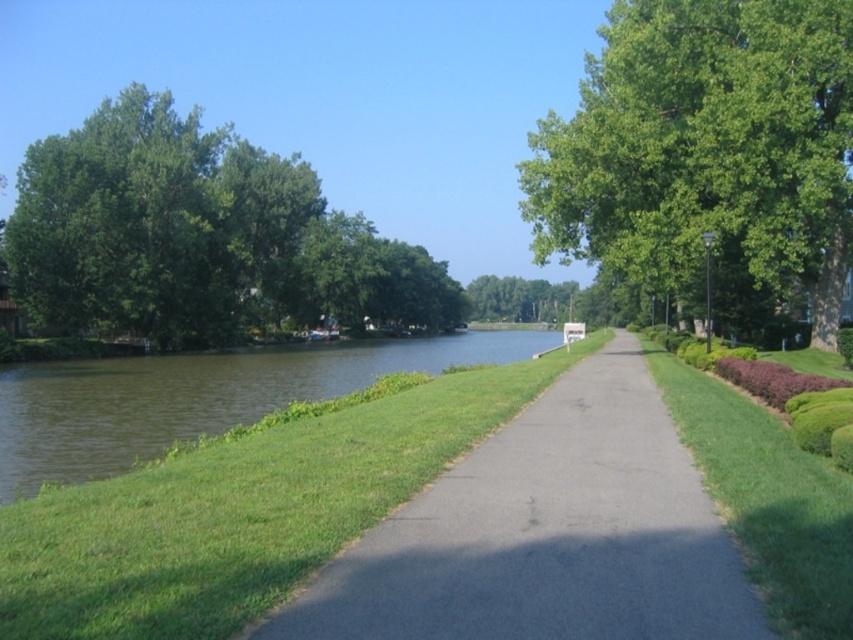
You are standing on the paved pathway and want to take a photo of both the green leafy tree at upper right and the green leafy tree at upper left. Which tree should you focus on first to ensure both are in the frame?

You should focus on the green leafy tree at upper left first because it is farther away from you than the green leafy tree at upper right, so adjusting the camera to include the farther tree ensures the closer one is also in the frame.

Consider the image. You are standing on the paved pathway and want to take a photo of both the green grass at center and the green leafy tree at center. Which object should you focus on first to ensure both are in the frame?

You should focus on the green grass at center first because it is closer to you than the green leafy tree at center, so adjusting the camera to include it will also capture the tree behind it.

You are a gardener planning to plant a new flower bed along the paved pathway. You want to place the flowers between the green grass at center and the green leafy tree at upper left. Based on their positions, where should the flower bed be placed?

The flower bed should be placed below the green leafy tree at upper left and above the green grass at center since the green grass at center is located below the green leafy tree at upper left.